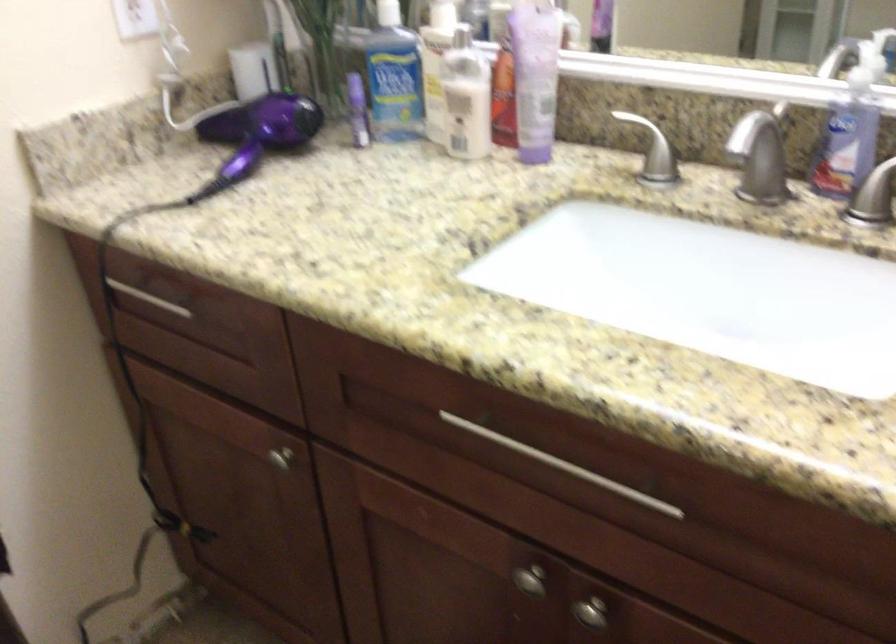
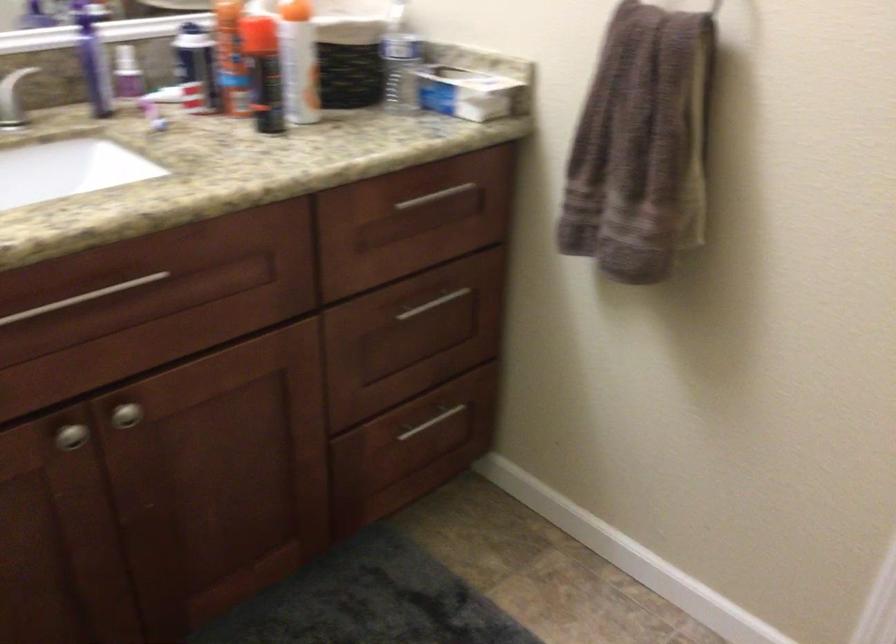
In the second image, find the point that corresponds to point (522, 574) in the first image.

(71, 436)